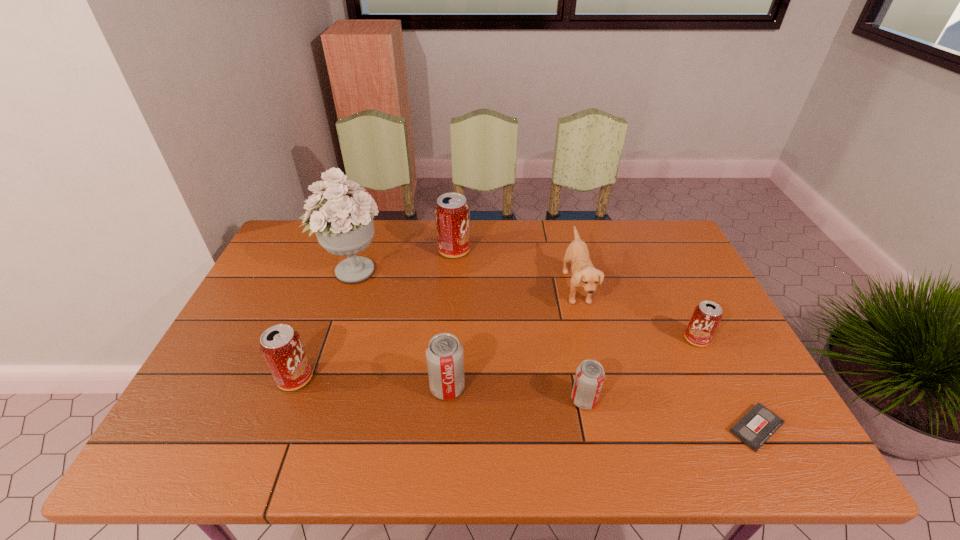
Where is `unoccupied area between the leftmost soda can and the videotape`? unoccupied area between the leftmost soda can and the videotape is located at coordinates (526, 403).

Find the location of a particular element. The width and height of the screenshot is (960, 540). vacant space that's between the smaller gray soda can and the tallest soda can is located at coordinates (519, 325).

Where is `empty space that is in between the tallest object and the second smallest red soda can`? The width and height of the screenshot is (960, 540). empty space that is in between the tallest object and the second smallest red soda can is located at coordinates (324, 325).

Locate an element on the screen. empty location between the second red soda can from left to right and the green bouquet is located at coordinates (403, 261).

Where is `free space between the puppy and the nearest red soda can`? free space between the puppy and the nearest red soda can is located at coordinates (436, 333).

Image resolution: width=960 pixels, height=540 pixels. What are the coordinates of `free space between the bigger gray soda can and the rightmost red soda can` in the screenshot? It's located at (572, 363).

Where is `the seventh closest object relative to the tallest object`? the seventh closest object relative to the tallest object is located at coordinates (759, 423).

You are a GUI agent. You are given a task and a screenshot of the screen. Output one action in this format:
    pyautogui.click(x=<x>, y=<y>)
    Task: Click on the object that is the fourth closest to the rightmost soda can
    
    Given the screenshot: What is the action you would take?
    pyautogui.click(x=445, y=358)

The height and width of the screenshot is (540, 960). Identify the location of soda can that is the fifth closest to the shortest object. tap(281, 347).

Locate which soda can ranks fourth in proximity to the shortest object. Please provide its 2D coordinates. Your answer should be formatted as a tuple, i.e. [(x, y)], where the tuple contains the x and y coordinates of a point satisfying the conditions above.

[(452, 213)]